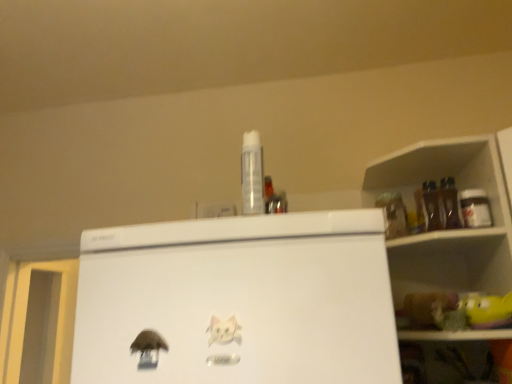
This screenshot has height=384, width=512. What do you see at coordinates (223, 330) in the screenshot? I see `white paper cat at center` at bounding box center [223, 330].

This screenshot has height=384, width=512. What do you see at coordinates (252, 174) in the screenshot? I see `transparent plastic spray can at center, which ranks as the 2th bottle in right-to-left order` at bounding box center [252, 174].

You are a GUI agent. You are given a task and a screenshot of the screen. Output one action in this format:
    pyautogui.click(x=<x>, y=<y>)
    Task: Click on the metallic silver jar at upper right, marked as the second bottle in a left-to-right arrangement
    
    Given the screenshot: What is the action you would take?
    pyautogui.click(x=475, y=208)

In terms of height, does metallic silver jar at upper right, which appears as the 2th bottle when viewed from the front, look taller or shorter compared to white paper cat at center?

metallic silver jar at upper right, which appears as the 2th bottle when viewed from the front, is taller than white paper cat at center.

From the picture: Between metallic silver jar at upper right, acting as the first bottle starting from the back, and white paper cat at center, which one is positioned behind?

Positioned behind is metallic silver jar at upper right, acting as the first bottle starting from the back.

Is metallic silver jar at upper right, marked as the second bottle in a left-to-right arrangement, bigger than white paper cat at center?

Indeed, metallic silver jar at upper right, marked as the second bottle in a left-to-right arrangement, has a larger size compared to white paper cat at center.

From the picture: Is metallic silver jar at upper right, which appears as the 2th bottle when viewed from the front, positioned with its back to white paper cat at center?

No, metallic silver jar at upper right, which appears as the 2th bottle when viewed from the front, is not facing away from white paper cat at center.

Is white paper cat at center bigger than transparent plastic spray can at center, which ranks as the 2th bottle in right-to-left order?

Actually, white paper cat at center might be smaller than transparent plastic spray can at center, which ranks as the 2th bottle in right-to-left order.

Is white paper cat at center far from transparent plastic spray can at center, which ranks as the 2th bottle in right-to-left order?

white paper cat at center is near transparent plastic spray can at center, which ranks as the 2th bottle in right-to-left order, not far away.

Considering the points (232, 320) and (261, 212), which point is behind, point (232, 320) or point (261, 212)?

The point (261, 212) is more distant.

Considering the relative sizes of white paper cat at center and transparent plastic spray can at center, which ranks as the 1th bottle in left-to-right order, in the image provided, is white paper cat at center wider than transparent plastic spray can at center, which ranks as the 1th bottle in left-to-right order,?

In fact, white paper cat at center might be narrower than transparent plastic spray can at center, which ranks as the 1th bottle in left-to-right order.

From the image's perspective, is transparent plastic spray can at center, the 2th bottle positioned from the back, above metallic silver jar at upper right, which appears as the 2th bottle when viewed from the front?

Indeed, from the image's perspective, transparent plastic spray can at center, the 2th bottle positioned from the back, is shown above metallic silver jar at upper right, which appears as the 2th bottle when viewed from the front.

Is transparent plastic spray can at center, which is the 1th bottle from front to back, turned away from metallic silver jar at upper right, acting as the first bottle starting from the back?

No.

Is point (258, 178) positioned behind point (465, 222)?

No, (258, 178) is closer to viewer.

From the picture: Visually, is transparent plastic spray can at center, which is the 1th bottle from front to back, positioned to the left or to the right of metallic silver jar at upper right, which appears as the 2th bottle when viewed from the front?

In the image, transparent plastic spray can at center, which is the 1th bottle from front to back, appears on the left side of metallic silver jar at upper right, which appears as the 2th bottle when viewed from the front.

Measure the distance between matte plastic shelf at upper right and transparent plastic spray can at center, which ranks as the 1th bottle in left-to-right order.

54.92 centimeters.

Who is bigger, matte plastic shelf at upper right or transparent plastic spray can at center, which ranks as the 2th bottle in right-to-left order?

matte plastic shelf at upper right.

From a real-world perspective, does matte plastic shelf at upper right sit lower than transparent plastic spray can at center, which is the 1th bottle from front to back?

Indeed, from a real-world perspective, matte plastic shelf at upper right is positioned beneath transparent plastic spray can at center, which is the 1th bottle from front to back.

Considering the positions of point (485, 358) and point (244, 203), is point (485, 358) closer or farther from the camera than point (244, 203)?

Point (485, 358) appears to be farther away from the viewer than point (244, 203).

Considering the relative positions of white paper cat at center and matte plastic shelf at upper right in the image provided, is white paper cat at center to the right of matte plastic shelf at upper right from the viewer's perspective?

No.

Considering the sizes of objects white paper cat at center and matte plastic shelf at upper right in the image provided, who is bigger, white paper cat at center or matte plastic shelf at upper right?

With larger size is matte plastic shelf at upper right.

Is point (229, 324) positioned behind point (508, 250)?

No, it is in front of (508, 250).

From the image's perspective, is transparent plastic spray can at center, which ranks as the 2th bottle in right-to-left order, on top of white paper cat at center?

Indeed, from the image's perspective, transparent plastic spray can at center, which ranks as the 2th bottle in right-to-left order, is shown above white paper cat at center.

Is transparent plastic spray can at center, the 2th bottle positioned from the back, behind white paper cat at center?

Yes, transparent plastic spray can at center, the 2th bottle positioned from the back, is further from the viewer.

Is transparent plastic spray can at center, which ranks as the 2th bottle in right-to-left order, touching white paper cat at center?

They are not placed beside each other.

Which is behind, point (258, 173) or point (227, 322)?

Positioned behind is point (258, 173).

Are metallic silver jar at upper right, the first bottle positioned from the right, and transparent plastic spray can at center, which ranks as the 1th bottle in left-to-right order, making contact?

No, metallic silver jar at upper right, the first bottle positioned from the right, is not making contact with transparent plastic spray can at center, which ranks as the 1th bottle in left-to-right order.

From a real-world perspective, is metallic silver jar at upper right, the first bottle positioned from the right, positioned under transparent plastic spray can at center, which ranks as the 1th bottle in left-to-right order, based on gravity?

Yes.

Measure the distance between metallic silver jar at upper right, marked as the second bottle in a left-to-right arrangement, and transparent plastic spray can at center, which ranks as the 1th bottle in left-to-right order.

metallic silver jar at upper right, marked as the second bottle in a left-to-right arrangement, is 20.39 inches from transparent plastic spray can at center, which ranks as the 1th bottle in left-to-right order.

Considering the positions of objects metallic silver jar at upper right, marked as the second bottle in a left-to-right arrangement, and transparent plastic spray can at center, the 2th bottle positioned from the back, in the image provided, who is in front, metallic silver jar at upper right, marked as the second bottle in a left-to-right arrangement, or transparent plastic spray can at center, the 2th bottle positioned from the back,?

transparent plastic spray can at center, the 2th bottle positioned from the back.

I want to click on animal that is under the metallic silver jar at upper right, acting as the first bottle starting from the back (from a real-world perspective), so click(223, 330).

Find the location of `animal below the transparent plastic spray can at center, which ranks as the 1th bottle in left-to-right order (from the image's perspective)`. animal below the transparent plastic spray can at center, which ranks as the 1th bottle in left-to-right order (from the image's perspective) is located at coordinates (223, 330).

Estimate the real-world distances between objects in this image. Which object is further from matte plastic shelf at upper right, transparent plastic spray can at center, which ranks as the 2th bottle in right-to-left order, or metallic silver jar at upper right, marked as the second bottle in a left-to-right arrangement?

transparent plastic spray can at center, which ranks as the 2th bottle in right-to-left order.

When comparing their distances from metallic silver jar at upper right, marked as the second bottle in a left-to-right arrangement, does white paper cat at center or matte plastic shelf at upper right seem closer?

Among the two, matte plastic shelf at upper right is located nearer to metallic silver jar at upper right, marked as the second bottle in a left-to-right arrangement.

When comparing their distances from transparent plastic spray can at center, the 2th bottle positioned from the back, does matte plastic shelf at upper right or white paper cat at center seem further?

The object further to transparent plastic spray can at center, the 2th bottle positioned from the back, is matte plastic shelf at upper right.

Based on their spatial positions, is matte plastic shelf at upper right or transparent plastic spray can at center, which ranks as the 1th bottle in left-to-right order, closer to metallic silver jar at upper right, marked as the second bottle in a left-to-right arrangement?

matte plastic shelf at upper right is closer to metallic silver jar at upper right, marked as the second bottle in a left-to-right arrangement.

Considering their positions, is matte plastic shelf at upper right positioned closer to transparent plastic spray can at center, which ranks as the 2th bottle in right-to-left order, than metallic silver jar at upper right, the first bottle positioned from the right?

Among the two, metallic silver jar at upper right, the first bottle positioned from the right, is located nearer to transparent plastic spray can at center, which ranks as the 2th bottle in right-to-left order.

When comparing their distances from transparent plastic spray can at center, which ranks as the 2th bottle in right-to-left order, does white paper cat at center or matte plastic shelf at upper right seem further?

Based on the image, matte plastic shelf at upper right appears to be further to transparent plastic spray can at center, which ranks as the 2th bottle in right-to-left order.

From the image, which object appears to be nearer to matte plastic shelf at upper right, white paper cat at center or transparent plastic spray can at center, which ranks as the 2th bottle in right-to-left order?

The object closer to matte plastic shelf at upper right is transparent plastic spray can at center, which ranks as the 2th bottle in right-to-left order.

From the image, which object appears to be nearer to metallic silver jar at upper right, acting as the first bottle starting from the back, matte plastic shelf at upper right or white paper cat at center?

Based on the image, matte plastic shelf at upper right appears to be nearer to metallic silver jar at upper right, acting as the first bottle starting from the back.

At what (x,y) coordinates should I click in order to perform the action: click on shelf situated between transparent plastic spray can at center, which is the 1th bottle from front to back, and metallic silver jar at upper right, acting as the first bottle starting from the back, from left to right. Please return your answer as a coordinate pair (x, y). Looking at the image, I should click on (448, 260).

At what (x,y) coordinates should I click in order to perform the action: click on bottle located between white paper cat at center and metallic silver jar at upper right, which appears as the 2th bottle when viewed from the front, in the left-right direction. Please return your answer as a coordinate pair (x, y). Looking at the image, I should click on (252, 174).

At what (x,y) coordinates should I click in order to perform the action: click on bottle between white paper cat at center and matte plastic shelf at upper right from left to right. Please return your answer as a coordinate pair (x, y). Image resolution: width=512 pixels, height=384 pixels. Looking at the image, I should click on (252, 174).

Find the location of a particular element. The image size is (512, 384). shelf between white paper cat at center and metallic silver jar at upper right, the first bottle positioned from the right, from left to right is located at coordinates (448, 260).